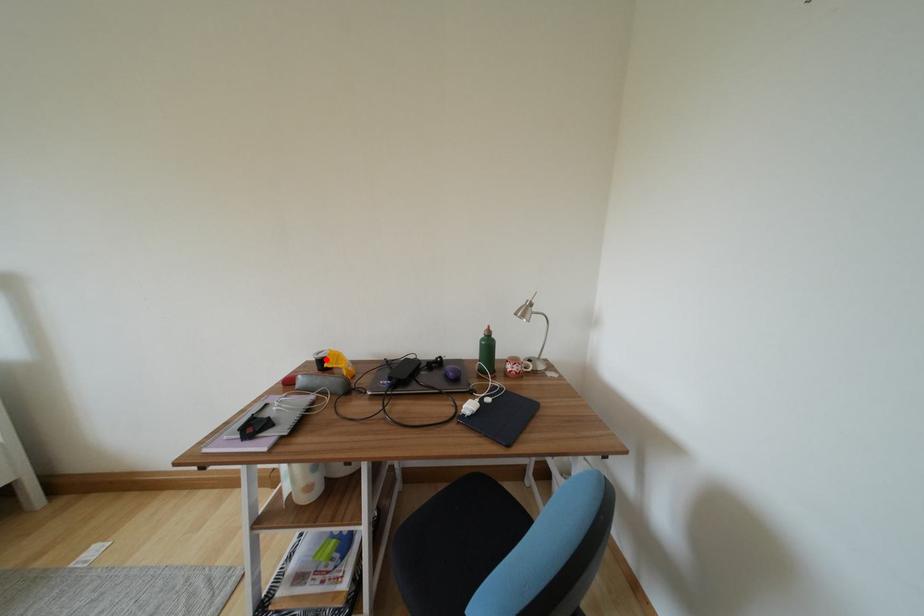
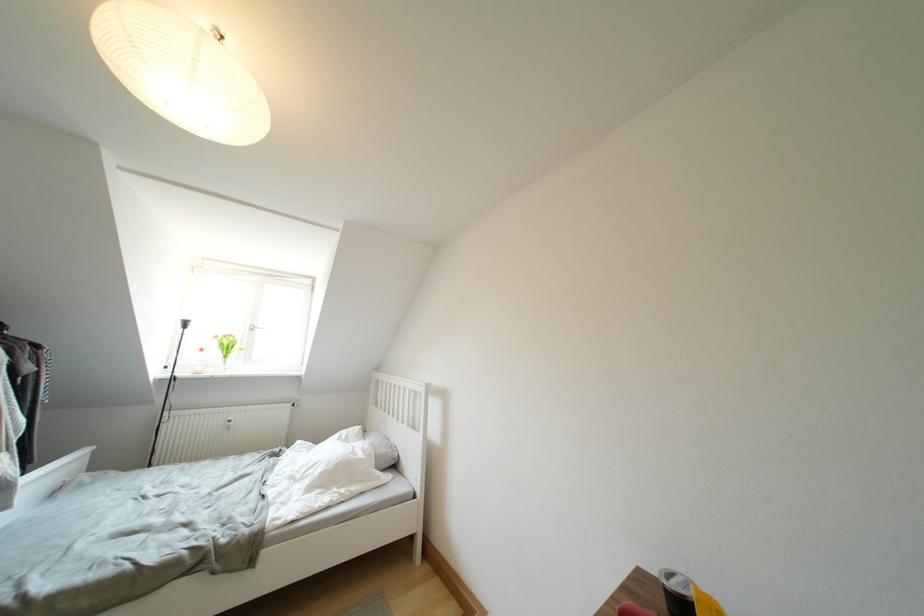
In the second image, find the point that corresponds to the highlighted location in the first image.

(678, 589)